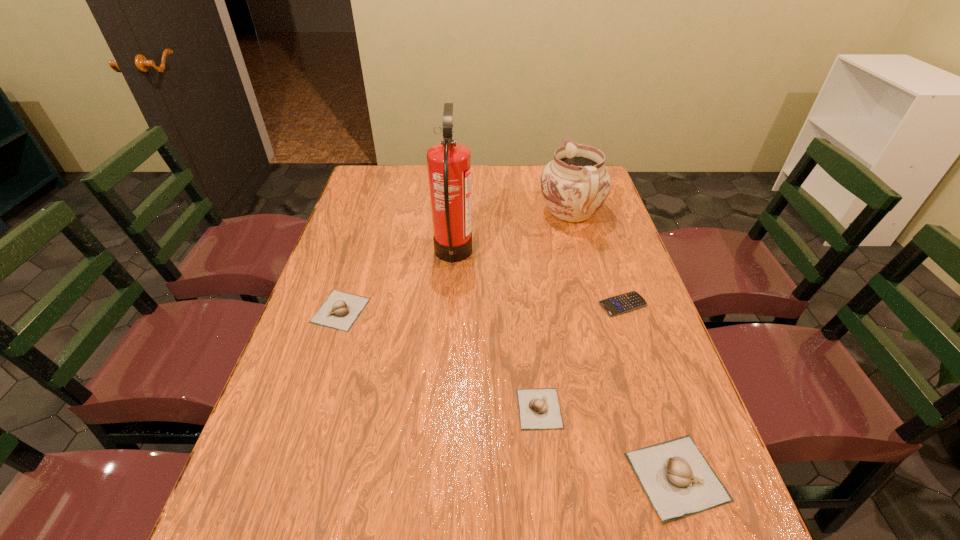
This screenshot has height=540, width=960. Find the location of `free space located 0.380m on the right of the farthest garlic`. free space located 0.380m on the right of the farthest garlic is located at coordinates (513, 310).

Where is `vacant space located on the left of the second garlic from right to left`? The image size is (960, 540). vacant space located on the left of the second garlic from right to left is located at coordinates (470, 409).

The height and width of the screenshot is (540, 960). I want to click on vacant space located 0.160m on the back of the fourth shortest object, so click(641, 370).

Identify the location of vacant space situated 0.120m on the left of the calculator. The height and width of the screenshot is (540, 960). (554, 304).

Where is `vacant space located 0.200m on the front-facing side of the second object from left to right`? This screenshot has height=540, width=960. vacant space located 0.200m on the front-facing side of the second object from left to right is located at coordinates (539, 255).

At what (x,y) coordinates should I click in order to perform the action: click on free location located 0.100m on the spout of the pitcher. Please return your answer as a coordinate pair (x, y). The height and width of the screenshot is (540, 960). Looking at the image, I should click on (562, 178).

Identify the location of vacant space positioned 0.070m on the spout of the pitcher. The image size is (960, 540). (563, 182).

Where is `free space located 0.060m on the spout of the pitcher`? free space located 0.060m on the spout of the pitcher is located at coordinates (564, 184).

The width and height of the screenshot is (960, 540). I want to click on object located in the far edge section of the desktop, so click(x=575, y=184).

Where is `object that is at the near edge`? This screenshot has height=540, width=960. object that is at the near edge is located at coordinates (678, 480).